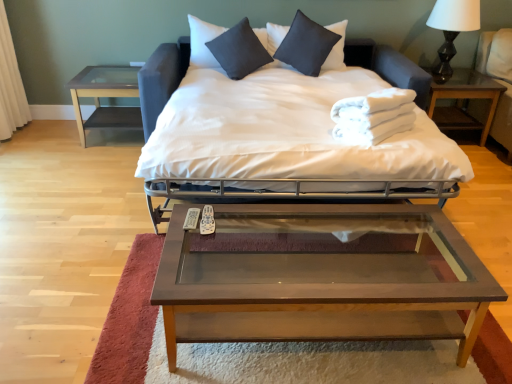
Question: Is point (443, 89) positioned closer to the camera than point (138, 67)?

Choices:
 (A) closer
 (B) farther

Answer: (B)

Question: Is white fabric towels at right, the second nightstand positioned from the left, taller or shorter than clear glass table at left, which appears as the 2th nightstand when viewed from the right?

Choices:
 (A) short
 (B) tall

Answer: (A)

Question: Which object is the closest to the white matte table lamp at upper right?

Choices:
 (A) white fabric towels at right, the second nightstand positioned from the left
 (B) clear glass table at left, acting as the first nightstand starting from the left
 (C) white fabric curtain at left
 (D) dark gray linen pillow at center, the 2th pillow positioned from the right
 (E) brown wood/glass coffee table at center

Answer: (A)

Question: Which of these objects is positioned closest to the dark gray linen pillow at center, arranged as the 1th pillow when viewed from the left?

Choices:
 (A) white fabric bed at center
 (B) white matte table lamp at upper right
 (C) brown wood/glass coffee table at center
 (D) light brown wood armchair at right
 (E) white fluffy towels at center

Answer: (A)